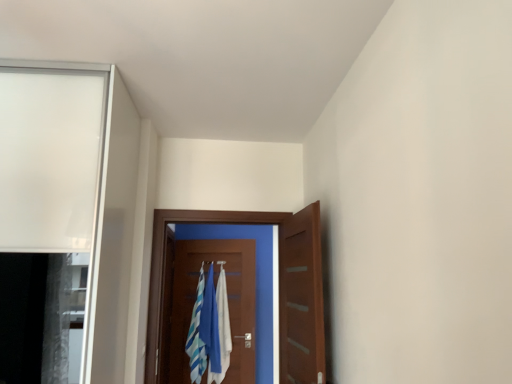
Identify the location of wooden door at center, which ranks as the 2th door in front-to-back order. This screenshot has height=384, width=512. (279, 288).

What do you see at coordinates (222, 327) in the screenshot?
I see `white cotton bath towel at center` at bounding box center [222, 327].

Identify the location of white cotton bath towel at center. The image size is (512, 384). (222, 327).

This screenshot has width=512, height=384. Identify the location of wooden door at center, positioned as the 2th door in back-to-front order. (279, 288).

Is wooden door at center, which ranks as the 2th door in front-to-back order, not near wooden door at center, which is counted as the 1th door, starting from the back?

wooden door at center, which ranks as the 2th door in front-to-back order, is positioned a significant distance from wooden door at center, which is counted as the 1th door, starting from the back.

Considering their positions, is wooden door at center, which ranks as the 2th door in front-to-back order, located in front of or behind wooden door at center, which is counted as the 1th door, starting from the back?

wooden door at center, which ranks as the 2th door in front-to-back order, is in front of wooden door at center, which is counted as the 1th door, starting from the back.

Between wooden door at center, positioned as the 2th door in back-to-front order, and wooden door at center, which is counted as the 1th door, starting from the back, which one has more height?

wooden door at center, which is counted as the 1th door, starting from the back, is taller.

I want to click on the 2nd door directly beneath the wooden door at center, which ranks as the 2th door in front-to-back order (from a real-world perspective), so click(x=228, y=303).

From the picture: Would you say wooden door at center, the first door from the front, is inside or outside white cotton bath towel at center?

wooden door at center, the first door from the front, cannot be found inside white cotton bath towel at center.

How many degrees apart are the facing directions of wooden door at center, the first door from the front, and white cotton bath towel at center?

The angular difference between wooden door at center, the first door from the front, and white cotton bath towel at center is 79.2 degrees.

Could you measure the distance between wooden door at center, the 3th door when ordered from back to front, and white cotton bath towel at center?

5.32 feet.

Considering the positions of point (313, 369) and point (217, 287), is point (313, 369) closer or farther from the camera than point (217, 287)?

Clearly, point (313, 369) is closer to the camera than point (217, 287).

From the image's perspective, starting from the blue fabric laundry at center, which door is the 1st one above? Please provide its 2D coordinates.

[(228, 303)]

Who is more distant, blue fabric laundry at center or wooden door at center, which is counted as the 1th door, starting from the back?

blue fabric laundry at center is behind.

From the image's perspective, is blue fabric laundry at center positioned above or below wooden door at center, which is counted as the 3th door, starting from the front?

Based on their image positions, blue fabric laundry at center is located beneath wooden door at center, which is counted as the 3th door, starting from the front.

Would you say wooden door at center, which is counted as the 1th door, starting from the back, is part of blue fabric laundry at center's contents?

No.

In terms of size, does wooden door at center, which is counted as the 1th door, starting from the back, appear bigger or smaller than wooden door at center, positioned as the 2th door in back-to-front order?

Considering their sizes, wooden door at center, which is counted as the 1th door, starting from the back, takes up less space than wooden door at center, positioned as the 2th door in back-to-front order.

From the image's perspective, is wooden door at center, which is counted as the 1th door, starting from the back, over wooden door at center, which ranks as the 2th door in front-to-back order?

Actually, wooden door at center, which is counted as the 1th door, starting from the back, appears below wooden door at center, which ranks as the 2th door in front-to-back order, in the image.

Considering the sizes of objects wooden door at center, which is counted as the 1th door, starting from the back, and wooden door at center, which ranks as the 2th door in front-to-back order, in the image provided, who is wider, wooden door at center, which is counted as the 1th door, starting from the back, or wooden door at center, which ranks as the 2th door in front-to-back order,?

With larger width is wooden door at center, which ranks as the 2th door in front-to-back order.

From the image's perspective, is white cotton bath towel at center located above or below blue fabric laundry at center?

From the image's perspective, white cotton bath towel at center appears above blue fabric laundry at center.

Can you confirm if white cotton bath towel at center is shorter than blue fabric laundry at center?

No, white cotton bath towel at center is not shorter than blue fabric laundry at center.

Is point (224, 347) farther from viewer compared to point (197, 360)?

No, (224, 347) is in front of (197, 360).

Considering their positions, is white cotton bath towel at center located in front of or behind blue fabric laundry at center?

white cotton bath towel at center is positioned closer to the viewer than blue fabric laundry at center.

Which of these two, blue fabric laundry at center or wooden door at center, positioned as the 2th door in back-to-front order, is thinner?

blue fabric laundry at center is thinner.

How many degrees apart are the facing directions of blue fabric laundry at center and wooden door at center, which ranks as the 2th door in front-to-back order?

6.69 degrees separate the facing orientations of blue fabric laundry at center and wooden door at center, which ranks as the 2th door in front-to-back order.

Is wooden door at center, which ranks as the 2th door in front-to-back order, at the back of blue fabric laundry at center?

No, blue fabric laundry at center is not facing the opposite direction of wooden door at center, which ranks as the 2th door in front-to-back order.

From the image's perspective, relative to wooden door at center, which ranks as the 2th door in front-to-back order, is blue fabric laundry at center above or below?

Clearly, from the image's perspective, blue fabric laundry at center is below wooden door at center, which ranks as the 2th door in front-to-back order.

How many degrees apart are the facing directions of wooden door at center, which is counted as the 1th door, starting from the back, and blue fabric laundry at center?

The facing directions of wooden door at center, which is counted as the 1th door, starting from the back, and blue fabric laundry at center are 6.69 degrees apart.

From the image's perspective, is wooden door at center, which is counted as the 3th door, starting from the front, on top of blue fabric laundry at center?

Yes, from the image's perspective, wooden door at center, which is counted as the 3th door, starting from the front, is over blue fabric laundry at center.

From a real-world perspective, which is physically below, wooden door at center, which is counted as the 1th door, starting from the back, or blue fabric laundry at center?

blue fabric laundry at center.

Who is shorter, wooden door at center, which is counted as the 3th door, starting from the front, or blue fabric laundry at center?

Standing shorter between the two is blue fabric laundry at center.

I want to click on door behind the wooden door at center, which ranks as the 2th door in front-to-back order, so click(228, 303).

What are the coordinates of `bath towel below the wooden door at center, the 3th door when ordered from back to front (from the image's perspective)` in the screenshot? It's located at (222, 327).

Which object lies nearer to the anchor point wooden door at center, the 3th door when ordered from back to front, wooden door at center, which is counted as the 3th door, starting from the front, or blue fabric laundry at center?

blue fabric laundry at center lies closer to wooden door at center, the 3th door when ordered from back to front, than the other object.

Which object lies nearer to the anchor point wooden door at center, the first door from the front, white cotton bath towel at center or blue fabric laundry at center?

blue fabric laundry at center is positioned closer to the anchor wooden door at center, the first door from the front.

Based on their spatial positions, is wooden door at center, the 3th door when ordered from back to front, or blue fabric laundry at center closer to white cotton bath towel at center?

blue fabric laundry at center lies closer to white cotton bath towel at center than the other object.

Which object lies nearer to the anchor point wooden door at center, positioned as the 2th door in back-to-front order, white cotton bath towel at center or wooden door at center, which is counted as the 3th door, starting from the front?

wooden door at center, which is counted as the 3th door, starting from the front.

Looking at the image, which one is located closer to blue fabric laundry at center, wooden door at center, positioned as the 2th door in back-to-front order, or white cotton bath towel at center?

Based on the image, white cotton bath towel at center appears to be nearer to blue fabric laundry at center.

Based on their spatial positions, is wooden door at center, which ranks as the 2th door in front-to-back order, or wooden door at center, which is counted as the 1th door, starting from the back, closer to wooden door at center, the first door from the front?

Among the two, wooden door at center, which ranks as the 2th door in front-to-back order, is located nearer to wooden door at center, the first door from the front.

Considering their positions, is wooden door at center, which is counted as the 1th door, starting from the back, positioned closer to white cotton bath towel at center than wooden door at center, positioned as the 2th door in back-to-front order?

wooden door at center, which is counted as the 1th door, starting from the back, is closer to white cotton bath towel at center.

Estimate the real-world distances between objects in this image. Which object is closer to wooden door at center, which is counted as the 1th door, starting from the back, blue fabric laundry at center or white cotton bath towel at center?

blue fabric laundry at center is positioned closer to the anchor wooden door at center, which is counted as the 1th door, starting from the back.

At what (x,y) coordinates should I click in order to perform the action: click on laundry located between wooden door at center, which is counted as the 1th door, starting from the back, and white cotton bath towel at center in the left-right direction. Please return your answer as a coordinate pair (x, y). This screenshot has height=384, width=512. Looking at the image, I should click on (209, 329).

The height and width of the screenshot is (384, 512). Find the location of `door between wooden door at center, the first door from the front, and wooden door at center, which is counted as the 1th door, starting from the back, in the front-back direction`. door between wooden door at center, the first door from the front, and wooden door at center, which is counted as the 1th door, starting from the back, in the front-back direction is located at coordinates (279, 288).

The image size is (512, 384). I want to click on bath towel between wooden door at center, the first door from the front, and blue fabric laundry at center in the front-back direction, so click(222, 327).

This screenshot has width=512, height=384. Identify the location of bath towel between wooden door at center, which ranks as the 2th door in front-to-back order, and blue fabric laundry at center, along the z-axis. (222, 327).